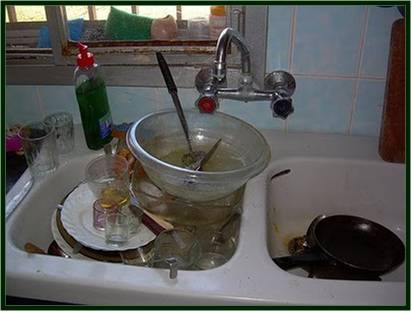
The image size is (412, 312). I want to click on skillet, so click(358, 244).